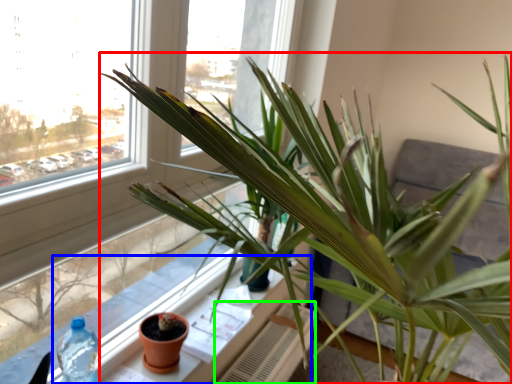
Question: Which object is the farthest from houseplant (highlighted by a red box)? Choose among these: window sill (highlighted by a blue box) or radiator (highlighted by a green box).

Choices:
 (A) window sill
 (B) radiator

Answer: (B)